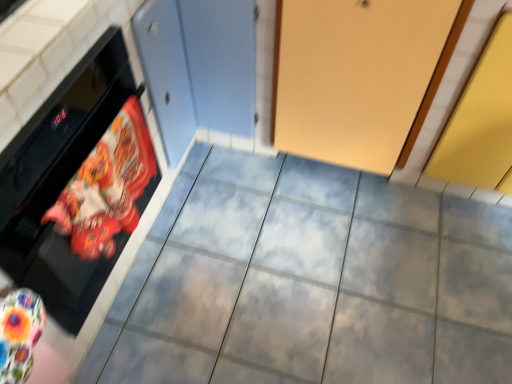
Question: Would you say printed fabric oven mitt at left is to the left or to the right of matte gray tile at center in the picture?

Choices:
 (A) right
 (B) left

Answer: (B)

Question: From a real-world perspective, relative to matte gray tile at center, is printed fabric oven mitt at left vertically above or below?

Choices:
 (A) above
 (B) below

Answer: (A)

Question: Which is nearer to the printed fabric oven mitt at left?

Choices:
 (A) black glossy oven at left
 (B) matte gray tile at center

Answer: (A)

Question: Which of these objects is positioned closest to the printed fabric oven mitt at left?

Choices:
 (A) matte gray tile at center
 (B) black glossy oven at left

Answer: (B)